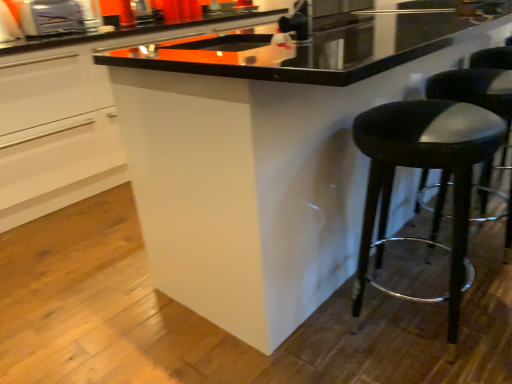
You are a GUI agent. You are given a task and a screenshot of the screen. Output one action in this format:
    pyautogui.click(x=<x>, y=<y>)
    Task: Click on the vacant space positioned to the left of black leather stool at lower right
    This screenshot has width=512, height=384.
    Given the screenshot: What is the action you would take?
    pyautogui.click(x=310, y=350)